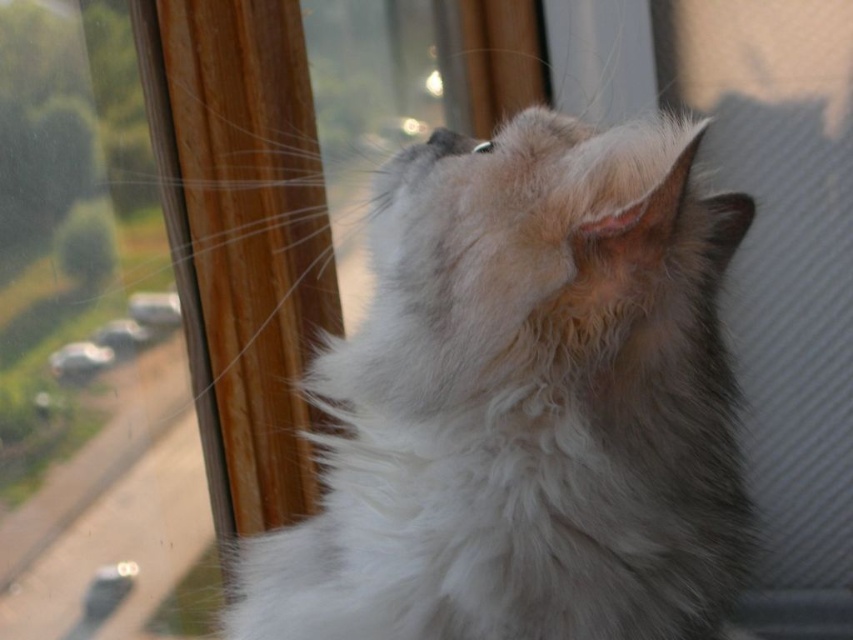
Is the position of white fluffy cat at center less distant than that of black fur nose at center?

That is True.

Does white fluffy cat at center have a lesser width compared to black fur nose at center?

In fact, white fluffy cat at center might be wider than black fur nose at center.

Is point (619, 529) positioned before point (465, 148)?

Yes, it is in front of point (465, 148).

Locate an element on the screen. This screenshot has height=640, width=853. white fluffy cat at center is located at coordinates (524, 404).